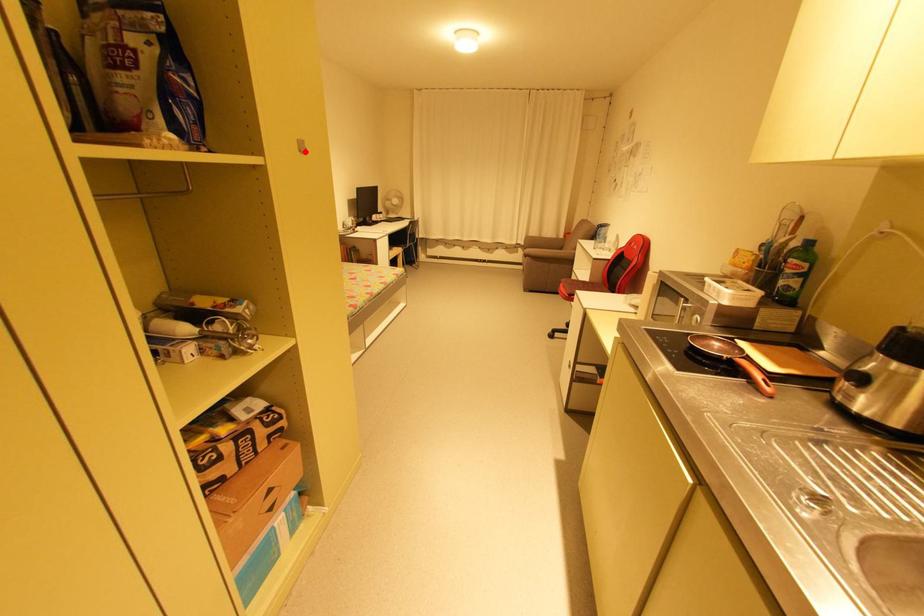
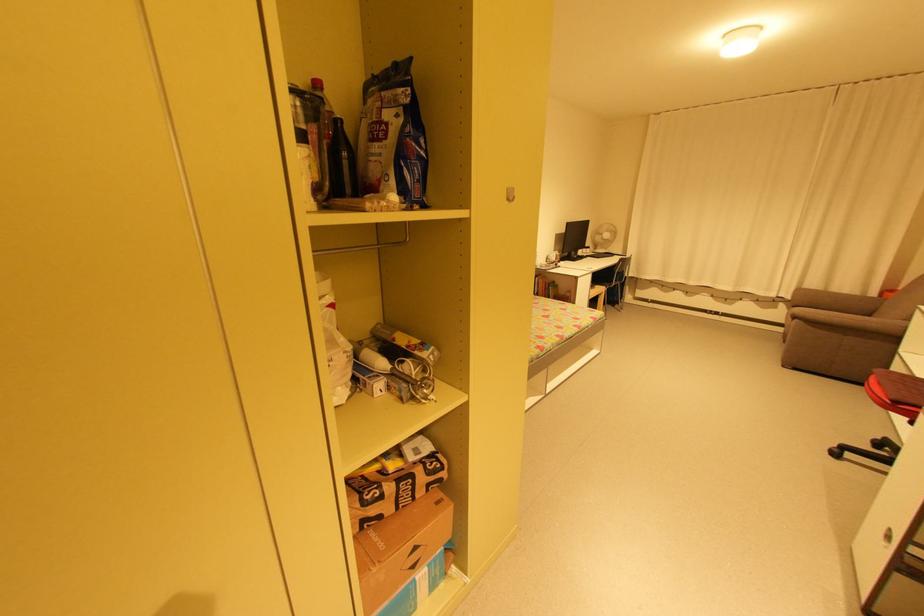
The point at the highlighted location is marked in the first image. Where is the corresponding point in the second image?

(513, 200)